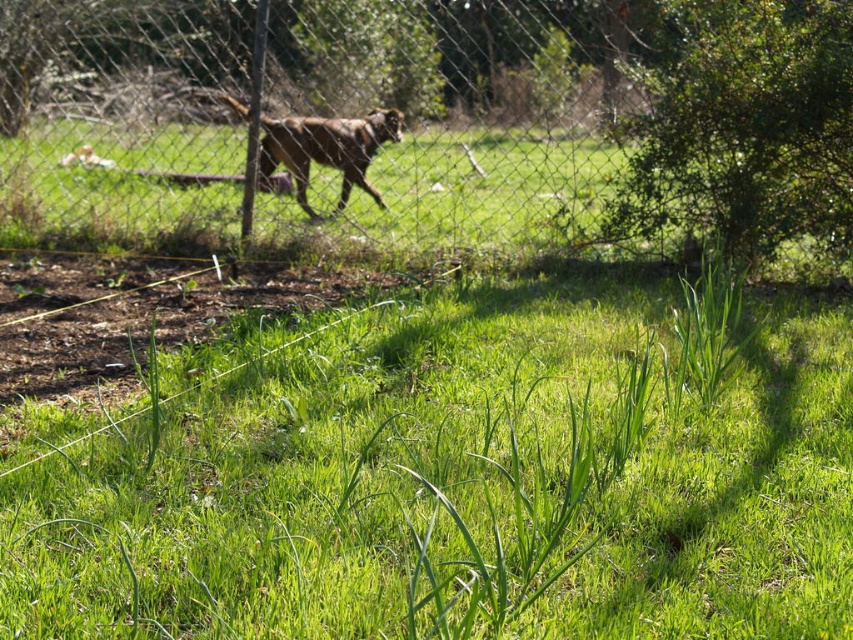
Who is higher up, green grassy at center or metal mesh fence at upper center?

metal mesh fence at upper center is above.

Describe the element at coordinates (450, 476) in the screenshot. I see `green grassy at center` at that location.

Between point (254, 353) and point (367, 90), which one is positioned in front?

Point (254, 353) is in front.

Locate an element on the screen. The width and height of the screenshot is (853, 640). green grassy at center is located at coordinates (450, 476).

Who is taller, metal mesh fence at upper center or brown furry dog at center?

With more height is metal mesh fence at upper center.

Is point (431, 122) closer to camera compared to point (241, 115)?

No, (431, 122) is behind (241, 115).

You are a GUI agent. You are given a task and a screenshot of the screen. Output one action in this format:
    pyautogui.click(x=<x>, y=<y>)
    Task: Click on the metal mesh fence at upper center
    The image size is (853, 640).
    Given the screenshot: What is the action you would take?
    click(x=326, y=120)

Which of these two, green grassy at center or brown furry dog at center, stands shorter?

brown furry dog at center is shorter.

Is point (573, 484) more distant than point (315, 134)?

No, (573, 484) is closer to viewer.

Does point (202, 502) lie behind point (270, 134)?

No.

At what (x,y) coordinates should I click in order to perform the action: click on green grassy at center. Please return your answer as a coordinate pair (x, y). Image resolution: width=853 pixels, height=640 pixels. Looking at the image, I should click on (450, 476).